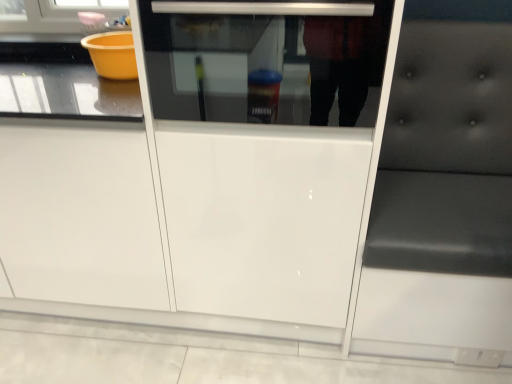
Locate an element on the screen. The height and width of the screenshot is (384, 512). black leather cushion at right is located at coordinates (443, 192).

Describe the element at coordinates (443, 192) in the screenshot. I see `black leather cushion at right` at that location.

The width and height of the screenshot is (512, 384). What do you see at coordinates (266, 60) in the screenshot? I see `transparent glass oven at center` at bounding box center [266, 60].

Where is `transparent glass oven at center`? Image resolution: width=512 pixels, height=384 pixels. transparent glass oven at center is located at coordinates (266, 60).

I want to click on black leather cushion at right, so click(x=443, y=192).

Is transparent glass oven at center at the left side of black leather cushion at right?

Correct, you'll find transparent glass oven at center to the left of black leather cushion at right.

Does transparent glass oven at center lie in front of black leather cushion at right?

No, it is behind black leather cushion at right.

Is point (223, 21) farther from camera compared to point (392, 280)?

No, it is not.

Consider the image. From the image's perspective, is transparent glass oven at center located beneath black leather cushion at right?

Incorrect, from the image's perspective, transparent glass oven at center is higher than black leather cushion at right.

From a real-world perspective, is transparent glass oven at center on black leather cushion at right?

Yes, from a real-world perspective, transparent glass oven at center is over black leather cushion at right

Considering the sizes of transparent glass oven at center and black leather cushion at right in the image, is transparent glass oven at center wider or thinner than black leather cushion at right?

Clearly, transparent glass oven at center has more width compared to black leather cushion at right.

From their relative heights in the image, would you say transparent glass oven at center is taller or shorter than black leather cushion at right?

transparent glass oven at center is shorter than black leather cushion at right.

Considering the sizes of objects transparent glass oven at center and black leather cushion at right in the image provided, who is smaller, transparent glass oven at center or black leather cushion at right?

transparent glass oven at center.

Is transparent glass oven at center positioned beyond the bounds of black leather cushion at right?

transparent glass oven at center lies outside black leather cushion at right's area.

Does transparent glass oven at center touch black leather cushion at right?

No, transparent glass oven at center is not beside black leather cushion at right.

Is black leather cushion at right at the back of transparent glass oven at center?

No, transparent glass oven at center is not facing away from black leather cushion at right.

What's the angular difference between transparent glass oven at center and black leather cushion at right's facing directions?

The angle between the facing direction of transparent glass oven at center and the facing direction of black leather cushion at right is 0.804 degrees.

You are a GUI agent. You are given a task and a screenshot of the screen. Output one action in this format:
    pyautogui.click(x=<x>, y=<y>)
    Task: Click on the furniture below the transparent glass oven at center (from the image's perspective)
    Image resolution: width=512 pixels, height=384 pixels.
    Given the screenshot: What is the action you would take?
    pyautogui.click(x=443, y=192)

Considering the relative positions of black leather cushion at right and transparent glass oven at center in the image provided, is black leather cushion at right to the left of transparent glass oven at center from the viewer's perspective?

Incorrect, black leather cushion at right is not on the left side of transparent glass oven at center.

Is the depth of black leather cushion at right greater than that of transparent glass oven at center?

No, black leather cushion at right is closer to the viewer.

Which point is more distant from viewer, (440,36) or (191,59)?

Point (440,36)

From the image's perspective, is black leather cushion at right on top of transparent glass oven at center?

No.

Consider the image. From a real-world perspective, is black leather cushion at right physically above transparent glass oven at center?

Incorrect, from a real-world perspective, black leather cushion at right is lower than transparent glass oven at center.

Which object is thinner, black leather cushion at right or transparent glass oven at center?

Thinner between the two is black leather cushion at right.

Considering the relative sizes of black leather cushion at right and transparent glass oven at center in the image provided, is black leather cushion at right taller than transparent glass oven at center?

Correct, black leather cushion at right is much taller as transparent glass oven at center.

Considering the sizes of black leather cushion at right and transparent glass oven at center in the image, is black leather cushion at right bigger or smaller than transparent glass oven at center?

Clearly, black leather cushion at right is larger in size than transparent glass oven at center.

Is black leather cushion at right surrounding transparent glass oven at center?

Definitely not — transparent glass oven at center is not inside black leather cushion at right.

Are black leather cushion at right and transparent glass oven at center far apart?

No, there isn't a large distance between black leather cushion at right and transparent glass oven at center.

Is black leather cushion at right looking in the opposite direction of transparent glass oven at center?

No, transparent glass oven at center is not at the back of black leather cushion at right.

In the scene shown: What's the angular difference between black leather cushion at right and transparent glass oven at center's facing directions?

There is a 0.804-degree angle between the facing directions of black leather cushion at right and transparent glass oven at center.

You are a GUI agent. You are given a task and a screenshot of the screen. Output one action in this format:
    pyautogui.click(x=<x>, y=<y>)
    Task: Click on the oven positioned vertically above the black leather cushion at right (from a real-world perspective)
    Image resolution: width=512 pixels, height=384 pixels.
    Given the screenshot: What is the action you would take?
    pyautogui.click(x=266, y=60)

Identify the location of oven on the left of black leather cushion at right. The width and height of the screenshot is (512, 384). (266, 60).

Locate an element on the screen. furniture below the transparent glass oven at center (from the image's perspective) is located at coordinates coord(443,192).